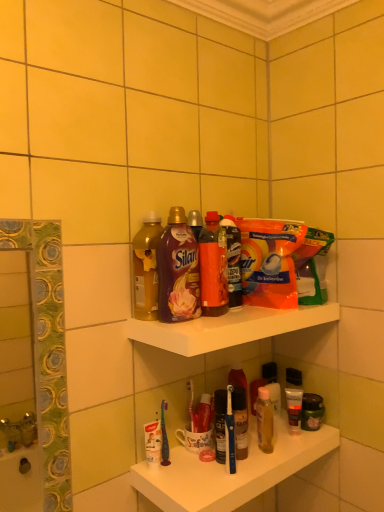
At what (x,y) coordinates should I click in order to perform the action: click on free space in front of translucent plastic bottle at upper center, positioned as the 2th cleaning product in right-to-left order. Please return your answer as a coordinate pair (x, y). Looking at the image, I should click on (235, 316).